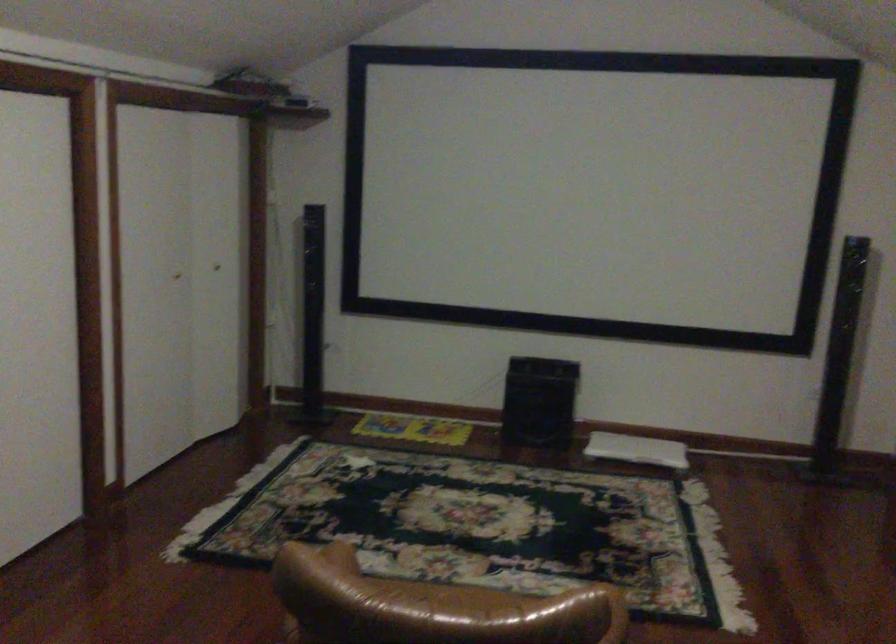
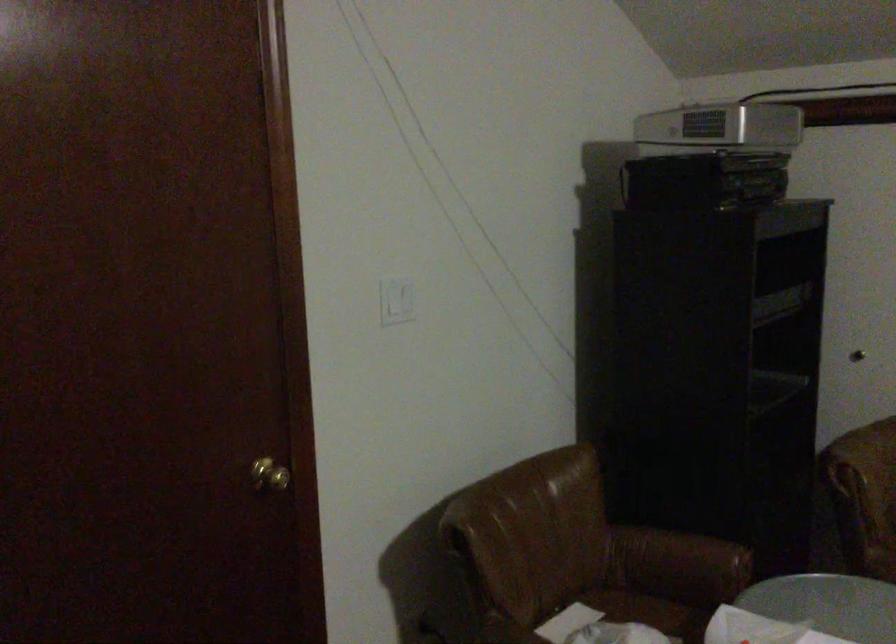
Question: The camera is either moving clockwise (left) or counter-clockwise (right) around the object. The first image is from the beginning of the video and the second image is from the end. Is the camera moving left or right when shooting the video?

Choices:
 (A) Left
 (B) Right

Answer: (B)